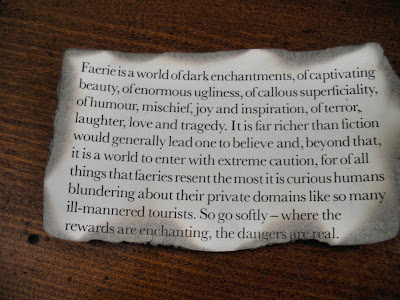
I want to click on wooden surface, so click(33, 116).